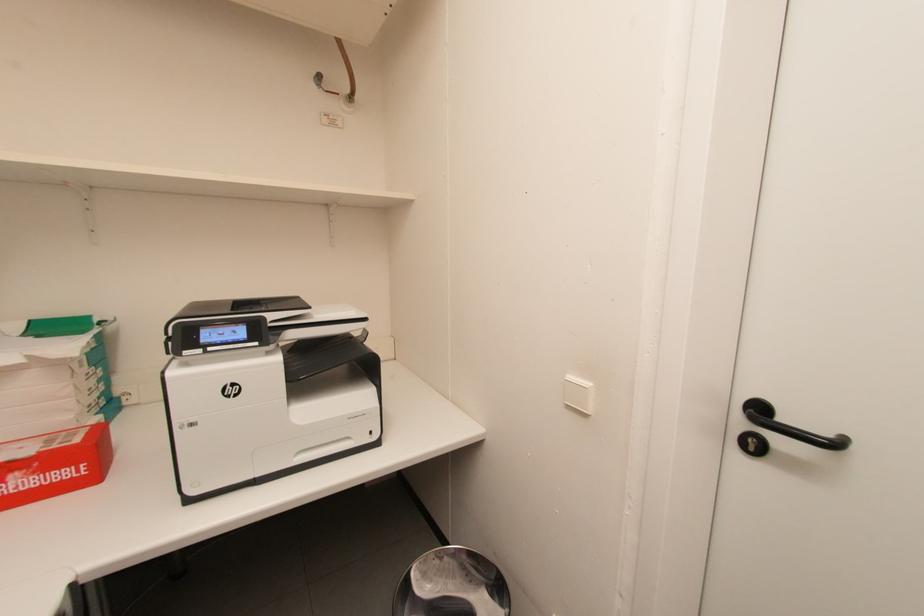
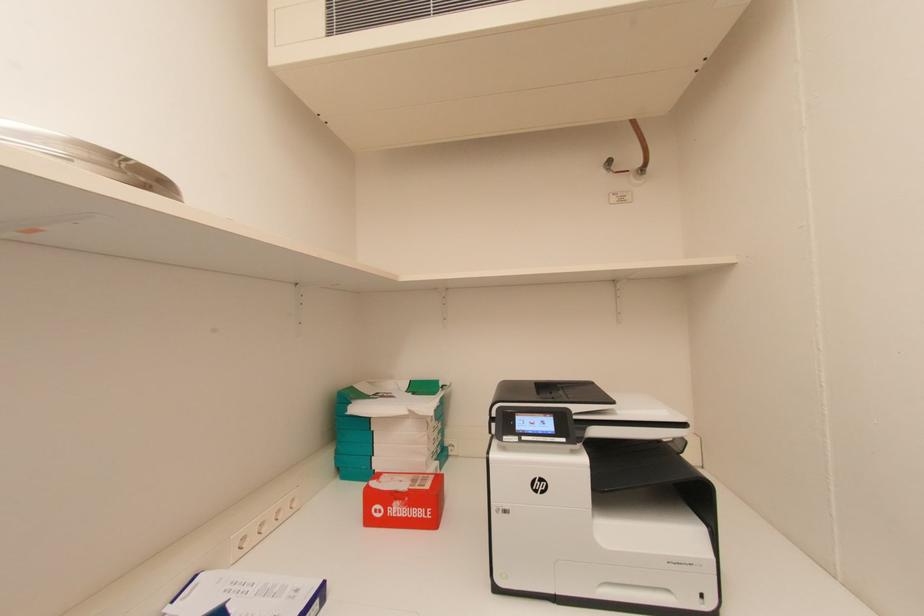
Question: The camera is either moving clockwise (left) or counter-clockwise (right) around the object. The first image is from the beginning of the video and the second image is from the end. Is the camera moving left or right when shooting the video?

Choices:
 (A) Left
 (B) Right

Answer: (B)